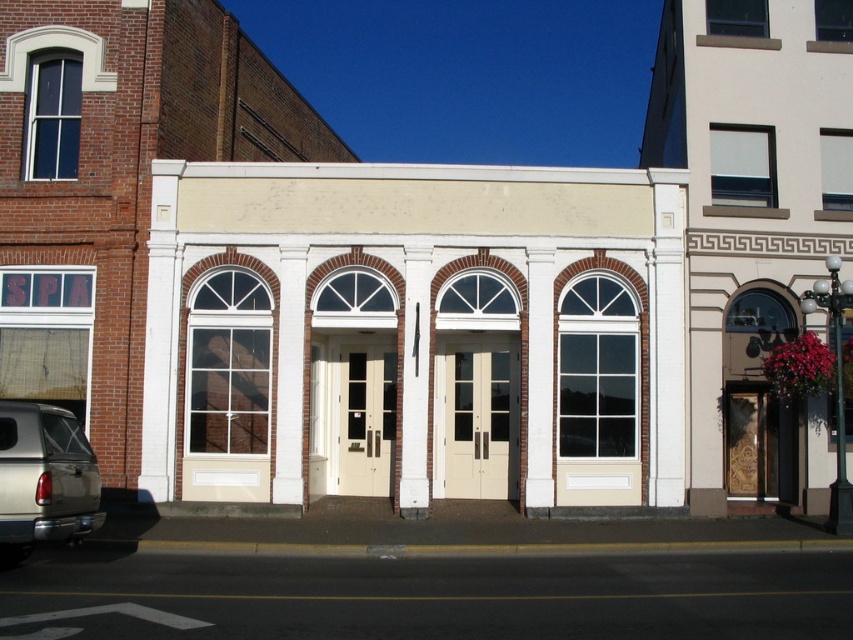
Between white painted wood doors at center and metallic silver truck at lower left, which one appears on the left side from the viewer's perspective?

metallic silver truck at lower left is more to the left.

Between point (350, 316) and point (41, 492), which one is positioned behind?

The point (350, 316) is behind.

What are the coordinates of `white painted wood doors at center` in the screenshot? It's located at (415, 332).